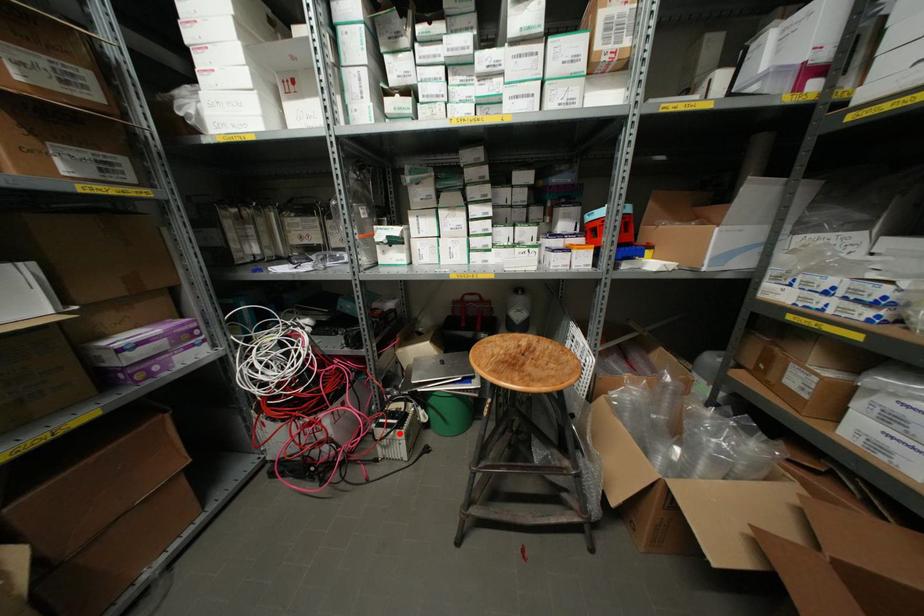
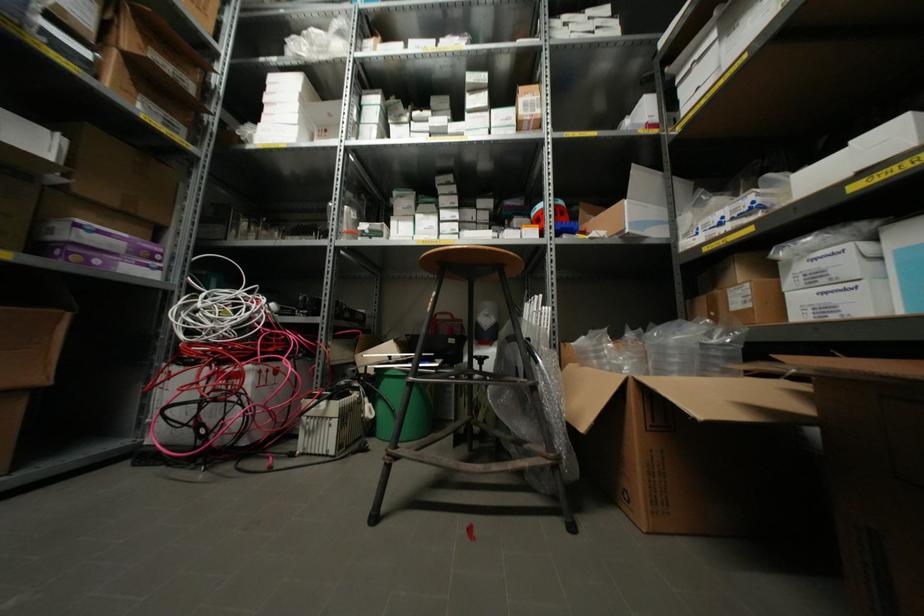
Find the pixel in the second image that matches the highlighted location in the first image.

(334, 406)